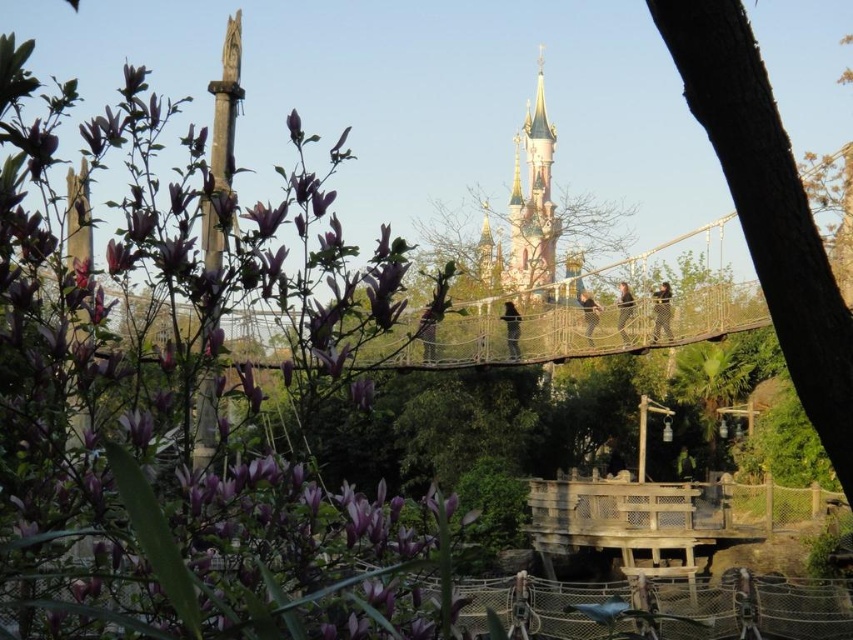
Question: Observing the image, what is the correct spatial positioning of brown rough bark tree at right in reference to pastel pink castle at upper center?

Choices:
 (A) below
 (B) above

Answer: (A)

Question: Does brown rough bark tree at right have a smaller size compared to pastel pink castle at upper center?

Choices:
 (A) no
 (B) yes

Answer: (B)

Question: Which point is closer to the camera taking this photo?

Choices:
 (A) (729, 131)
 (B) (537, 188)

Answer: (A)

Question: Can you confirm if brown rough bark tree at right is positioned above pastel pink castle at upper center?

Choices:
 (A) yes
 (B) no

Answer: (B)

Question: Which object is closer to the camera taking this photo?

Choices:
 (A) brown rough bark tree at right
 (B) pastel pink castle at upper center

Answer: (A)